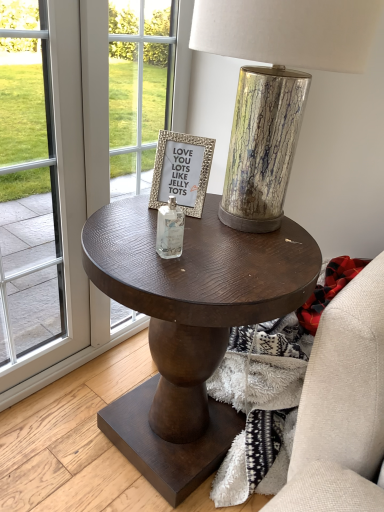
Identify the location of free location in front of gold textured frame at center. (158, 243).